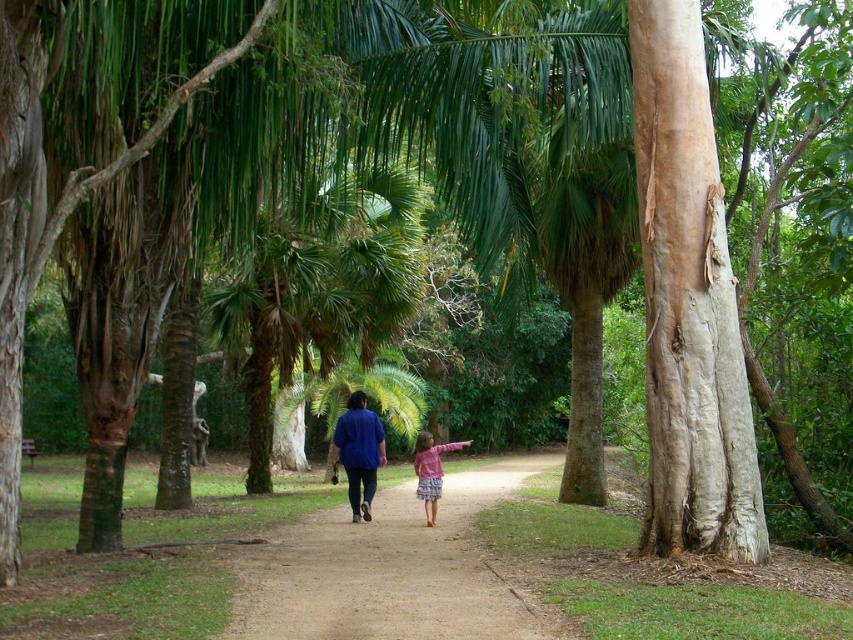
You are planning to walk along the dirt path at center while wearing the pink fabric dress at center. Considering the space each occupies, which one takes up more area in the image?

The pink fabric dress at center occupies more space than the dirt path at center in the image.

You are a photographer standing at the start of the dirt path in the park. You want to take a photo of both the blue cotton shirt at center and the pink fabric dress at center. Which one should you focus on first to ensure they are both in the frame?

The blue cotton shirt at center is above the pink fabric dress at center, so you should focus on the pink fabric dress at center first to ensure both are in the frame.